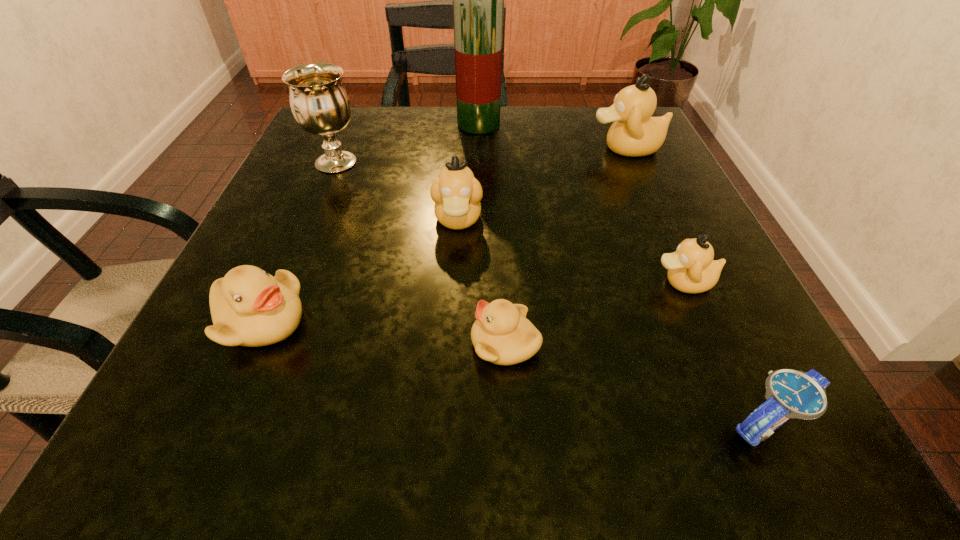
Locate an element on the screen. This screenshot has width=960, height=540. duckling located in the far edge section of the desktop is located at coordinates (634, 132).

You are a GUI agent. You are given a task and a screenshot of the screen. Output one action in this format:
    pyautogui.click(x=<x>, y=<y>)
    Task: Click on the object located in the near edge section of the desktop
    The width and height of the screenshot is (960, 540).
    Given the screenshot: What is the action you would take?
    click(x=789, y=393)

The image size is (960, 540). I want to click on chalice that is at the left edge, so click(320, 104).

Locate an element on the screen. This screenshot has width=960, height=540. duckling that is at the left edge is located at coordinates (249, 307).

At what (x,y) coordinates should I click in order to perform the action: click on watch that is at the right edge. Please return your answer as a coordinate pair (x, y). This screenshot has width=960, height=540. Looking at the image, I should click on click(789, 393).

Identify the location of object present at the far left corner. This screenshot has width=960, height=540. (320, 104).

Locate an element on the screen. object positioned at the far right corner is located at coordinates 634,132.

Where is `object positioned at the near right corner`? Image resolution: width=960 pixels, height=540 pixels. object positioned at the near right corner is located at coordinates (789, 393).

In the image, there is a desktop. What are the coordinates of `free space at the far edge` in the screenshot? It's located at (396, 148).

In order to click on vacant space at the near edge of the desktop in this screenshot , I will do `click(602, 449)`.